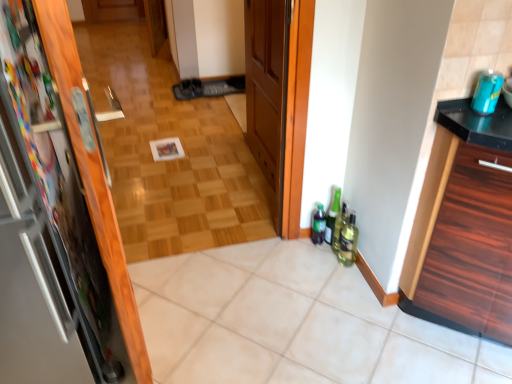
Question: Considering the relative positions of green glass bottle at lower right, which is the 1th bottle in right-to-left order, and green glass bottle at lower right, positioned as the 2th bottle in left-to-right order, in the image provided, is green glass bottle at lower right, which is the 1th bottle in right-to-left order, to the left or to the right of green glass bottle at lower right, positioned as the 2th bottle in left-to-right order,?

Choices:
 (A) left
 (B) right

Answer: (B)

Question: Is green glass bottle at lower right, positioned as the 3th bottle in left-to-right order, inside the boundaries of green glass bottle at lower right, which is counted as the second bottle, starting from the right, or outside?

Choices:
 (A) inside
 (B) outside

Answer: (B)

Question: Which of these objects is positioned closest to the green glass bottle at lower right, which is counted as the second bottle, starting from the right?

Choices:
 (A) white tile at center
 (B) teal matte can at upper right, positioned as the 2th beverage in bottom-to-top order
 (C) wooden door at center, which is the 2th door in left-to-right order
 (D) wooden parquet floor at center
 (E) metallic refrigerator at left, which appears as the second door when viewed from the right

Answer: (A)

Question: Which object is positioned farthest from the wooden parquet floor at center?

Choices:
 (A) green glass bottle at lower right, which appears as the 2th beverage when viewed from the front
 (B) metallic refrigerator at left, the 2th door viewed from the back
 (C) green matte bottle at lower right, which appears as the 3th bottle when viewed from the right
 (D) white tile at center
 (E) black wood cabinet at right

Answer: (A)